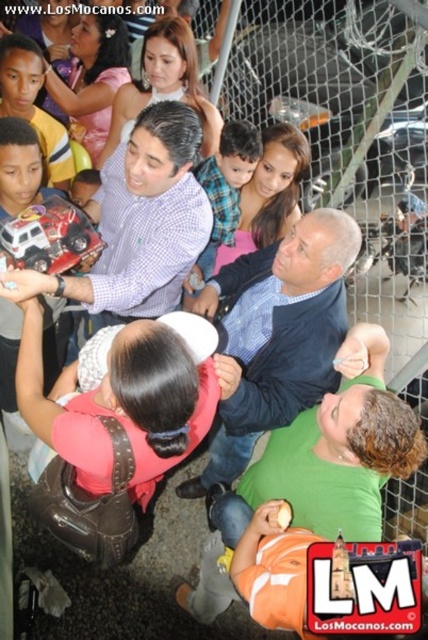
You are a photographer at the event and want to capture both the blue textured shirt at center and the matte plaid shirt at center in a single frame. Based on their positions, which shirt should you focus on first to ensure both are in the shot?

The blue textured shirt at center is below the matte plaid shirt at center, so you should focus on the matte plaid shirt at center first to ensure both are in the shot.

You are standing at the center of the image and see a blue textured shirt at center. Is there any object located exactly at point [276,336]?

Yes, the blue textured shirt at center is located exactly at point [276,336].